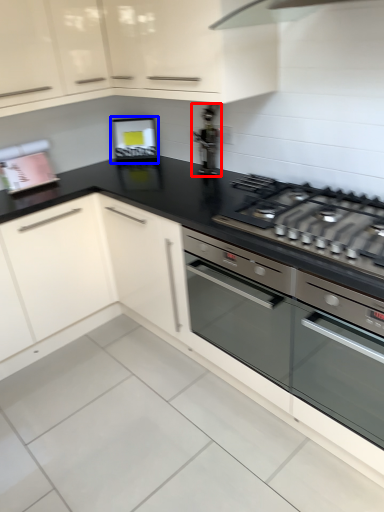
Question: Which of the following is the closest to the observer, appliance (highlighted by a red box) or appliance (highlighted by a blue box)?

Choices:
 (A) appliance
 (B) appliance

Answer: (A)